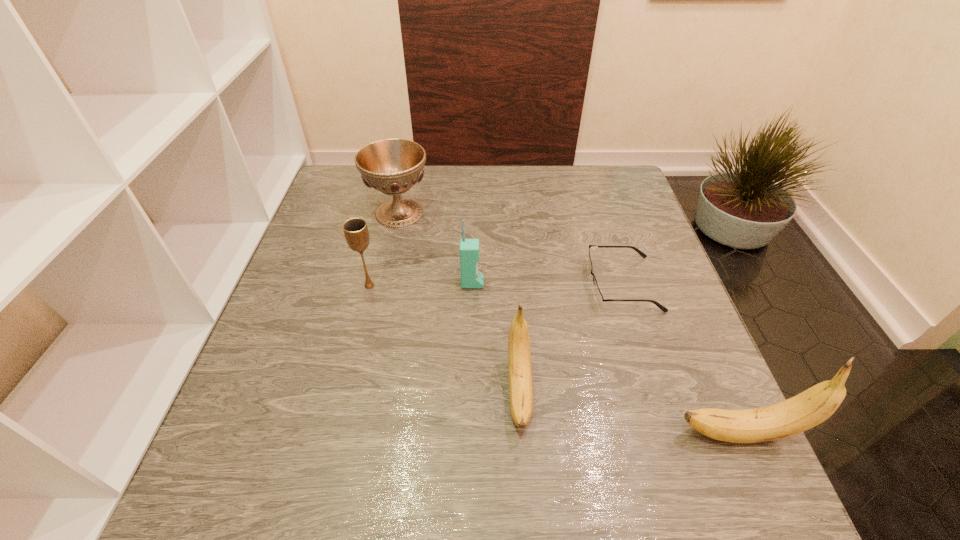
The width and height of the screenshot is (960, 540). Identify the location of spectacles located in the right edge section of the desktop. (598, 297).

I want to click on object that is positioned at the far left corner, so click(x=392, y=166).

Locate an element on the screen. This screenshot has height=540, width=960. object at the near right corner is located at coordinates (813, 406).

Find the location of a particular element. The image size is (960, 540). free space at the far edge of the desktop is located at coordinates (565, 193).

Where is `vacant space at the near edge of the desktop`? vacant space at the near edge of the desktop is located at coordinates 459,446.

In the image, there is a desktop. At what (x,y) coordinates should I click in order to perform the action: click on free space at the left edge. Please return your answer as a coordinate pair (x, y). Looking at the image, I should click on (340, 328).

The height and width of the screenshot is (540, 960). I want to click on vacant space at the right edge of the desktop, so click(x=664, y=355).

In the image, there is a desktop. Find the location of `vacant space at the far left corner`. vacant space at the far left corner is located at coordinates (348, 166).

The image size is (960, 540). Identify the location of free space at the far right corner. (596, 170).

You are a GUI agent. You are given a task and a screenshot of the screen. Output one action in this format:
    pyautogui.click(x=<x>, y=<y>)
    Task: Click on the empty location between the spectacles and the nearer chalice
    
    Given the screenshot: What is the action you would take?
    [x=495, y=285]